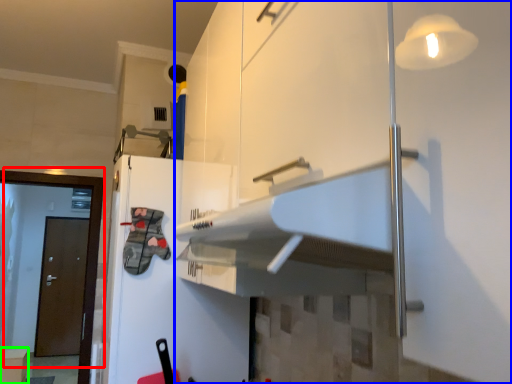
Question: Which object is the closest to the door (highlighted by a red box)? Choose among these: cabinetry (highlighted by a blue box) or cabinetry (highlighted by a green box).

Choices:
 (A) cabinetry
 (B) cabinetry

Answer: (A)